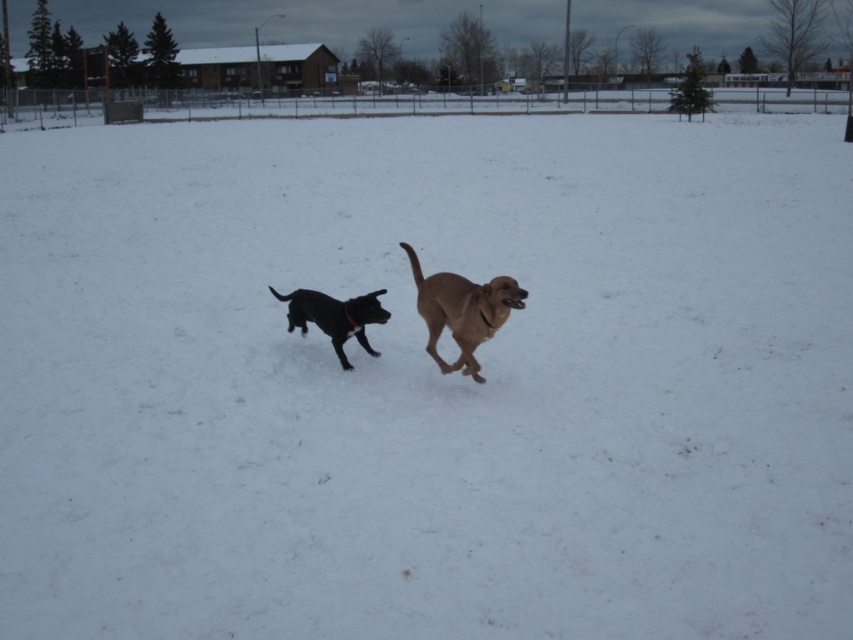
Does golden brown fur at center have a smaller size compared to shiny black dog at center?

No, golden brown fur at center is not smaller than shiny black dog at center.

Between point (405, 252) and point (310, 316), which one is positioned behind?

The point (405, 252) is more distant.

Does point (465, 339) come in front of point (350, 333)?

Yes, point (465, 339) is closer to viewer.

Locate an element on the screen. golden brown fur at center is located at coordinates (462, 310).